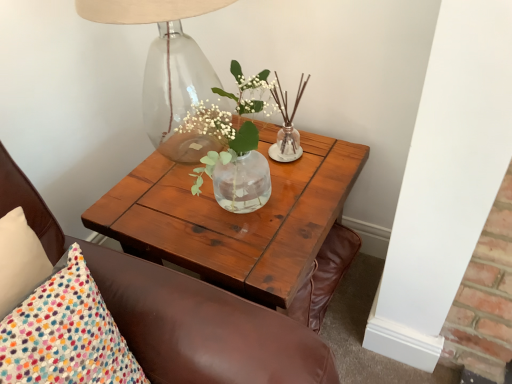
Measure the distance between brown leather chair at upper left and camera.

brown leather chair at upper left is 28.74 inches away from camera.

Identify the location of transparent glass table lamp at upper left. (167, 68).

From the image's perspective, is wooden coffee table at center above or below brown leather chair at upper left?

From the image's perspective, wooden coffee table at center appears above brown leather chair at upper left.

You are a GUI agent. You are given a task and a screenshot of the screen. Output one action in this format:
    pyautogui.click(x=<x>, y=<y>)
    Task: Click on the coffee table above the brown leather chair at upper left (from the image's perspective)
    
    Given the screenshot: What is the action you would take?
    pyautogui.click(x=234, y=219)

Looking at this image, can you confirm if wooden coffee table at center is taller than brown leather chair at upper left?

In fact, wooden coffee table at center may be shorter than brown leather chair at upper left.

Does wooden coffee table at center touch brown leather chair at upper left?

No.

Considering the positions of points (176, 79) and (189, 186), is point (176, 79) closer to camera compared to point (189, 186)?

Yes, point (176, 79) is closer to viewer.

Relative to wooden coffee table at center, is transparent glass table lamp at upper left in front or behind?

transparent glass table lamp at upper left is positioned closer to the viewer than wooden coffee table at center.

Considering the sizes of transparent glass table lamp at upper left and wooden coffee table at center in the image, is transparent glass table lamp at upper left taller or shorter than wooden coffee table at center?

Clearly, transparent glass table lamp at upper left is shorter compared to wooden coffee table at center.

From the image's perspective, is transparent glass table lamp at upper left on top of wooden coffee table at center?

Correct, transparent glass table lamp at upper left appears higher than wooden coffee table at center in the image.

Does transparent glass table lamp at upper left come in front of brown leather chair at upper left?

No.

From a real-world perspective, is transparent glass table lamp at upper left beneath brown leather chair at upper left?

Actually, transparent glass table lamp at upper left is physically above brown leather chair at upper left in the real world.

Considering the relative sizes of transparent glass table lamp at upper left and brown leather chair at upper left in the image provided, is transparent glass table lamp at upper left smaller than brown leather chair at upper left?

No.

Which point is more distant from viewer, (40, 215) or (166, 168)?

The point (166, 168) is behind.

Considering the positions of objects brown leather chair at upper left and wooden coffee table at center in the image provided, who is behind, brown leather chair at upper left or wooden coffee table at center?

wooden coffee table at center.

This screenshot has width=512, height=384. Identify the location of chair above the wooden coffee table at center (from a real-world perspective). (180, 311).

Between brown leather chair at upper left and wooden coffee table at center, which one has less height?

Standing shorter between the two is wooden coffee table at center.

At what (x,y) coordinates should I click in order to perform the action: click on coffee table on the right of transparent glass table lamp at upper left. Please return your answer as a coordinate pair (x, y). The width and height of the screenshot is (512, 384). Looking at the image, I should click on (234, 219).

From their relative heights in the image, would you say wooden coffee table at center is taller or shorter than transparent glass table lamp at upper left?

Considering their sizes, wooden coffee table at center has more height than transparent glass table lamp at upper left.

How many degrees apart are the facing directions of wooden coffee table at center and transparent glass table lamp at upper left?

The angle between the facing direction of wooden coffee table at center and the facing direction of transparent glass table lamp at upper left is 0.443 degrees.

Considering the relative positions of wooden coffee table at center and transparent glass table lamp at upper left in the image provided, is wooden coffee table at center behind transparent glass table lamp at upper left?

Yes, the depth of wooden coffee table at center is greater than that of transparent glass table lamp at upper left.

Which is correct: brown leather chair at upper left is inside transparent glass table lamp at upper left, or outside of it?

brown leather chair at upper left cannot be found inside transparent glass table lamp at upper left.

Considering the relative sizes of brown leather chair at upper left and transparent glass table lamp at upper left in the image provided, is brown leather chair at upper left thinner than transparent glass table lamp at upper left?

Correct, the width of brown leather chair at upper left is less than that of transparent glass table lamp at upper left.

In the scene shown: Which object is further away from the camera, brown leather chair at upper left or transparent glass table lamp at upper left?

transparent glass table lamp at upper left.

Does brown leather chair at upper left turn towards transparent glass table lamp at upper left?

No, brown leather chair at upper left does not turn towards transparent glass table lamp at upper left.

I want to click on chair above the wooden coffee table at center (from a real-world perspective), so click(x=180, y=311).

You are a GUI agent. You are given a task and a screenshot of the screen. Output one action in this format:
    pyautogui.click(x=<x>, y=<y>)
    Task: Click on the coffee table that appears below the transparent glass table lamp at upper left (from the image's perspective)
    This screenshot has width=512, height=384.
    Given the screenshot: What is the action you would take?
    pyautogui.click(x=234, y=219)

When comparing their distances from transparent glass table lamp at upper left, does wooden coffee table at center or brown leather chair at upper left seem further?

brown leather chair at upper left is positioned further to the anchor transparent glass table lamp at upper left.

Which object lies further to the anchor point brown leather chair at upper left, wooden coffee table at center or transparent glass table lamp at upper left?

transparent glass table lamp at upper left is further to brown leather chair at upper left.

Based on the photo, when comparing their distances from wooden coffee table at center, does brown leather chair at upper left or transparent glass table lamp at upper left seem further?

Among the two, transparent glass table lamp at upper left is located further to wooden coffee table at center.

In the scene shown: From the image, which object appears to be farther from transparent glass table lamp at upper left, brown leather chair at upper left or wooden coffee table at center?

brown leather chair at upper left is further to transparent glass table lamp at upper left.

From the image, which object appears to be nearer to brown leather chair at upper left, transparent glass table lamp at upper left or wooden coffee table at center?

wooden coffee table at center is closer to brown leather chair at upper left.

From the picture: Which object lies further to the anchor point wooden coffee table at center, transparent glass table lamp at upper left or brown leather chair at upper left?

Based on the image, transparent glass table lamp at upper left appears to be further to wooden coffee table at center.

This screenshot has height=384, width=512. What are the coordinates of `coffee table that lies between transparent glass table lamp at upper left and brown leather chair at upper left from top to bottom` in the screenshot? It's located at (234, 219).